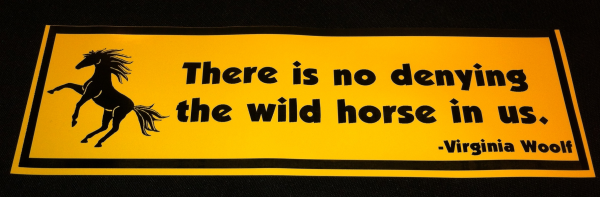
This screenshot has height=197, width=600. I want to click on the left front leg, so click(x=78, y=97).